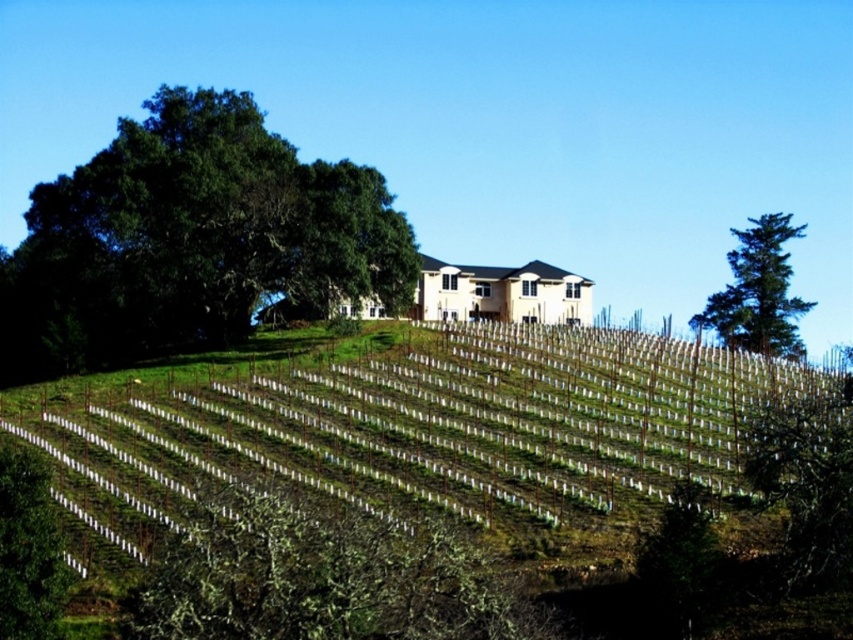
You are a gardener planning to plant a new row of grapevines between the green leafy tree at upper left and the green textured tree at right. Based on their positions, which tree should you start planting closer to?

The gardener should start planting closer to the green leafy tree at upper left because it is positioned to the left of the green textured tree at right, so the new row would logically begin near the leftmost tree.

You are a landscape architect reviewing the layout of the vineyard. You notice a point marked at coordinates (x=192, y=240) in the image. Based on the scene description, what object is located at that point?

The point at coordinates (x=192, y=240) corresponds to the green leafy tree at upper left.

You are a landscape architect planning to add a new pathway between the green leafy tree at upper left and the green textured tree at right. Considering their sizes, which tree will require more space around it to accommodate its canopy?

The green leafy tree at upper left requires more space around it because it is bigger than the green textured tree at right.